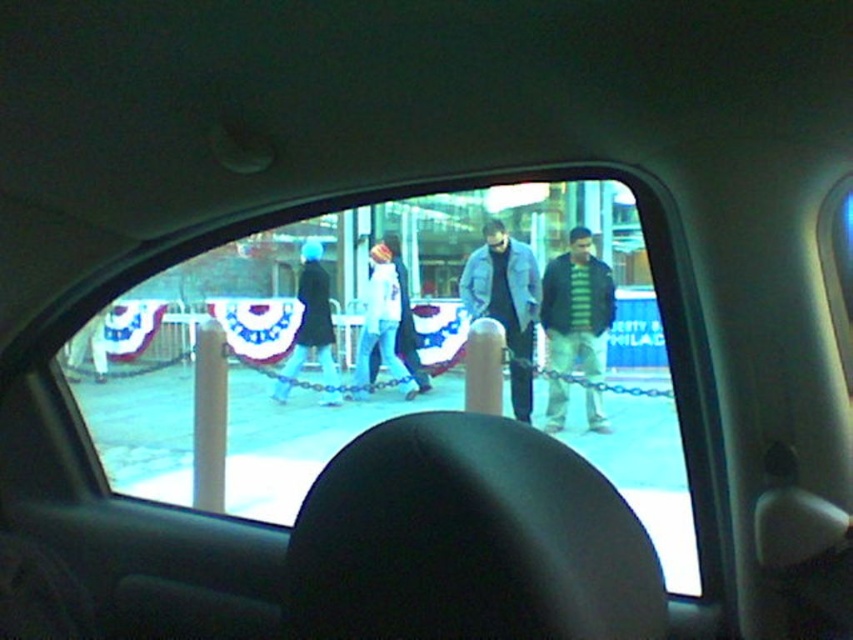
You are a fashion designer observing the scene from the vehicle. You need to determine which clothing item, the striped knit sweater at center or the denim jacket at center, would be more suitable for a winter fashion show. Based on their thickness, which would you choose?

The striped knit sweater at center is thinner than the denim jacket at center, so the denim jacket at center would be more suitable for a winter fashion show due to its thicker material providing better warmth.

You are sitting in the back seat of the vehicle and looking through the rear window. You see two points marked on the window. The first point is at coordinate point (582, 246) and the second point is at coordinate point (321, 362). Which point is closer to you?

Point (582, 246) is in front of point (321, 362), so the point closer to you is point (582, 246).

You are a photographer inside a car looking out the back window. You see two people outside near the barrier. One is wearing a striped knit sweater at center and the other a black coat at center. Which person is standing closer to the barrier?

The striped knit sweater at center is much taller as the black coat at center, so the person in the striped knit sweater at center is likely closer to the barrier since taller objects appear closer when viewed from a distance.